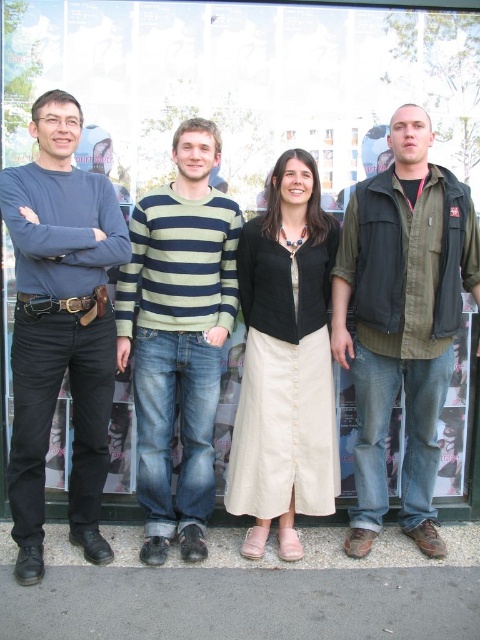
You are standing in front of the large glass window or display case and notice two points marked on the image. The first point is at coordinates point (468, 211) and the second is at point (290, 448). Which of these two points is closer to you?

Point (468, 211) is closer to the viewer than point (290, 448).

You are standing in front of the large glass window or display case in the scene. You need to locate the green cotton shirt at center. Where exactly is it positioned relative to the other people?

The green cotton shirt at center is positioned at point 0.502 on the horizontal axis and 0.838 on the vertical axis relative to the scene.